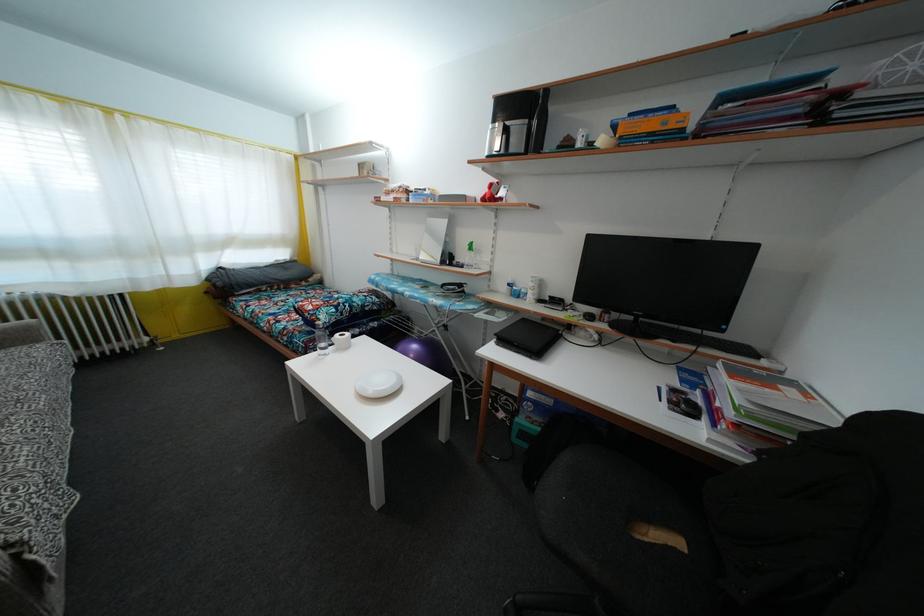
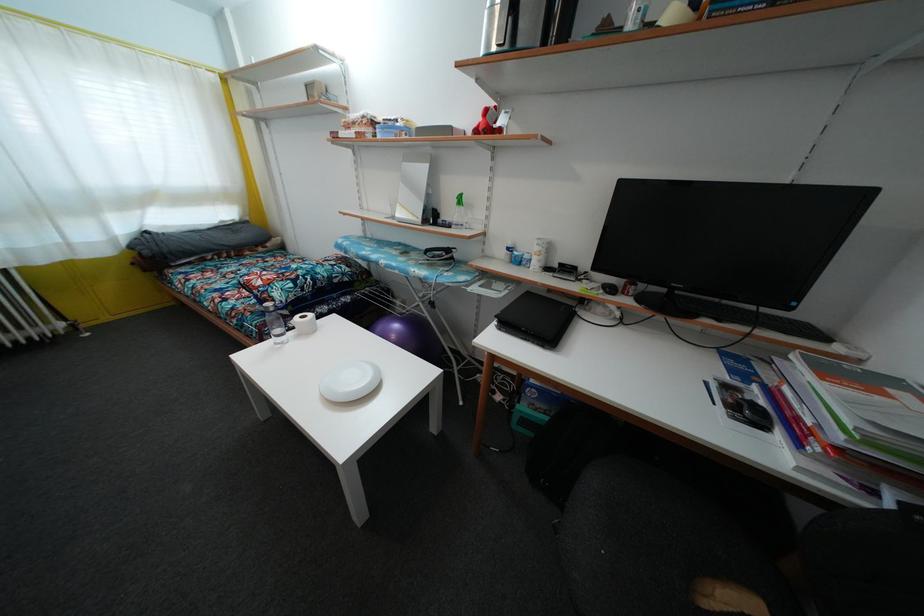
Question: The images are taken continuously from a first-person perspective. In which direction are you moving?

Choices:
 (A) Left
 (B) Right
 (C) Forward
 (D) Backward

Answer: (C)